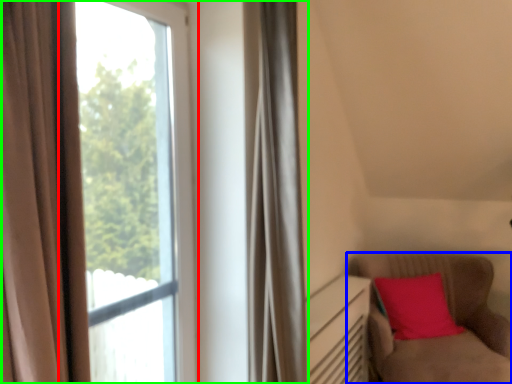
Question: Based on their relative distances, which object is nearer to window (highlighted by a red box)? Choose from furniture (highlighted by a blue box) and window (highlighted by a green box).

Choices:
 (A) furniture
 (B) window

Answer: (A)